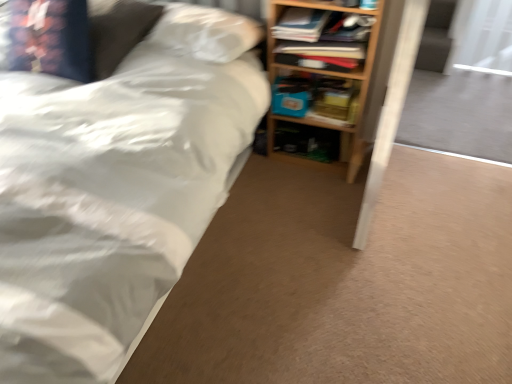
This screenshot has width=512, height=384. What do you see at coordinates (116, 188) in the screenshot?
I see `white matte bed at upper left` at bounding box center [116, 188].

Describe the element at coordinates (320, 39) in the screenshot. I see `wooden bookshelf at upper right, the first book from the front` at that location.

You are a GUI agent. You are given a task and a screenshot of the screen. Output one action in this format:
    pyautogui.click(x=<x>, y=<y>)
    Task: Click on the velvet-like floral pillow at upper left
    The width and height of the screenshot is (512, 384).
    Given the screenshot: What is the action you would take?
    pyautogui.click(x=50, y=38)

Find the location of a particular element. The width and height of the screenshot is (512, 384). wooden bookshelf at right is located at coordinates (342, 77).

The height and width of the screenshot is (384, 512). I want to click on transparent plastic screen door at upper right, so click(482, 35).

From the picture: Which of these two, blue matte paperback book at center or white matte bed at upper left, stands taller?

white matte bed at upper left is taller.

Considering the sizes of objects blue matte paperback book at center and white matte bed at upper left in the image provided, who is smaller, blue matte paperback book at center or white matte bed at upper left?

blue matte paperback book at center.

Looking at this image, would you say blue matte paperback book at center is outside white matte bed at upper left?

No, most part of blue matte paperback book at center lies within white matte bed at upper left.

Is blue matte paperback book at center with white matte bed at upper left?

No, blue matte paperback book at center is not with white matte bed at upper left.

Could you tell me if white matte bed at upper left is turned towards wooden bookshelf at right?

No, white matte bed at upper left is not turned towards wooden bookshelf at right.

Is white matte bed at upper left bigger or smaller than wooden bookshelf at right?

white matte bed at upper left is bigger than wooden bookshelf at right.

Which object is wider, white matte bed at upper left or wooden bookshelf at right?

white matte bed at upper left.

Which object is positioned more to the right, white matte bed at upper left or wooden bookshelf at right?

wooden bookshelf at right is more to the right.

Between wooden bookshelf at right and wooden bookshelf at upper right, the first book from the front, which one has larger width?

Wider between the two is wooden bookshelf at right.

Considering the positions of point (337, 125) and point (352, 50), is point (337, 125) closer or farther from the camera than point (352, 50)?

Point (337, 125) appears to be farther away from the viewer than point (352, 50).

Is wooden bookshelf at right bigger or smaller than wooden bookshelf at upper right, the second book in the back-to-front sequence?

Clearly, wooden bookshelf at right is larger in size than wooden bookshelf at upper right, the second book in the back-to-front sequence.

Is blue matte paperback book at center at the left side of matte blue book at center, acting as the 2th book starting from the front?

Yes.

Does blue matte paperback book at center have a larger size compared to matte blue book at center, which ranks as the first book in back-to-front order?

Actually, blue matte paperback book at center might be smaller than matte blue book at center, which ranks as the first book in back-to-front order.

Which of these two, blue matte paperback book at center or matte blue book at center, which ranks as the first book in back-to-front order, stands taller?

Standing taller between the two is matte blue book at center, which ranks as the first book in back-to-front order.

How much distance is there between matte blue book at center, acting as the 2th book starting from the front, and wooden bookshelf at upper right, the first book from the front?

matte blue book at center, acting as the 2th book starting from the front, and wooden bookshelf at upper right, the first book from the front, are 9.46 inches apart.

Is matte blue book at center, acting as the 2th book starting from the front, at the right side of wooden bookshelf at upper right, the second book in the back-to-front sequence?

Yes, matte blue book at center, acting as the 2th book starting from the front, is to the right of wooden bookshelf at upper right, the second book in the back-to-front sequence.

Which of these two, matte blue book at center, acting as the 2th book starting from the front, or wooden bookshelf at upper right, the second book in the back-to-front sequence, is thinner?

With smaller width is matte blue book at center, acting as the 2th book starting from the front.

Considering the points (314, 105) and (287, 19), which point is in front, point (314, 105) or point (287, 19)?

The point (287, 19) is closer to the camera.

Considering the sizes of wooden bookshelf at upper right, the first book from the front, and blue matte paperback book at center in the image, is wooden bookshelf at upper right, the first book from the front, wider or thinner than blue matte paperback book at center?

Considering their sizes, wooden bookshelf at upper right, the first book from the front, looks broader than blue matte paperback book at center.

Based on the photo, which of these two, wooden bookshelf at upper right, the first book from the front, or blue matte paperback book at center, stands shorter?

blue matte paperback book at center.

How many degrees apart are the facing directions of wooden bookshelf at upper right, the first book from the front, and blue matte paperback book at center?

1.53 degrees.

Which is farther from the camera, (309, 86) or (465, 9)?

Positioned behind is point (465, 9).

I want to click on screen door behind the matte blue book at center, which ranks as the first book in back-to-front order, so click(482, 35).

Does matte blue book at center, which ranks as the first book in back-to-front order, turn towards transparent plastic screen door at upper right?

No.

Does matte blue book at center, which ranks as the first book in back-to-front order, have a greater height compared to transparent plastic screen door at upper right?

In fact, matte blue book at center, which ranks as the first book in back-to-front order, may be shorter than transparent plastic screen door at upper right.

Find the location of a particular element. This screenshot has height=384, width=512. bed above the blue matte paperback book at center (from a real-world perspective) is located at coordinates (116, 188).

You are a GUI agent. You are given a task and a screenshot of the screen. Output one action in this format:
    pyautogui.click(x=<x>, y=<y>)
    Task: Click on the shelf that appears below the white matte bed at upper left (from a real-world perspective)
    This screenshot has height=384, width=512.
    Given the screenshot: What is the action you would take?
    pyautogui.click(x=342, y=77)

Considering their positions, is blue matte paperback book at center positioned closer to wooden bookshelf at right than transparent plastic screen door at upper right?

blue matte paperback book at center lies closer to wooden bookshelf at right than the other object.

Based on the photo, when comparing their distances from transparent plastic screen door at upper right, does wooden bookshelf at upper right, the second book in the back-to-front sequence, or velvet-like floral pillow at upper left seem closer?

wooden bookshelf at upper right, the second book in the back-to-front sequence, is closer to transparent plastic screen door at upper right.

From the image, which object appears to be nearer to blue matte paperback book at center, white matte bed at upper left or matte blue book at center, acting as the 2th book starting from the front?

matte blue book at center, acting as the 2th book starting from the front, is closer to blue matte paperback book at center.

When comparing their distances from blue matte paperback book at center, does wooden bookshelf at upper right, the first book from the front, or velvet-like floral pillow at upper left seem closer?

Based on the image, wooden bookshelf at upper right, the first book from the front, appears to be nearer to blue matte paperback book at center.

Looking at the image, which one is located closer to blue matte paperback book at center, white matte bed at upper left or wooden bookshelf at upper right, the second book in the back-to-front sequence?

The object closer to blue matte paperback book at center is wooden bookshelf at upper right, the second book in the back-to-front sequence.

From the image, which object appears to be nearer to wooden bookshelf at right, velvet-like floral pillow at upper left or transparent plastic screen door at upper right?

velvet-like floral pillow at upper left is closer to wooden bookshelf at right.

Based on their spatial positions, is velvet-like floral pillow at upper left or wooden bookshelf at right further from blue matte paperback book at center?

velvet-like floral pillow at upper left.

When comparing their distances from white matte bed at upper left, does wooden bookshelf at right or wooden bookshelf at upper right, the first book from the front, seem closer?

Based on the image, wooden bookshelf at upper right, the first book from the front, appears to be nearer to white matte bed at upper left.

Image resolution: width=512 pixels, height=384 pixels. I want to click on pillow positioned between white matte bed at upper left and matte blue book at center, acting as the 2th book starting from the front, from near to far, so click(50, 38).

Find the location of a particular element. The image size is (512, 384). pillow located between white matte bed at upper left and transparent plastic screen door at upper right in the left-right direction is located at coordinates (50, 38).

What are the coordinates of `shelf between white matte bed at upper left and matte blue book at center, acting as the 2th book starting from the front, in the front-back direction` in the screenshot? It's located at (342, 77).

The width and height of the screenshot is (512, 384). Find the location of `pillow positioned between white matte bed at upper left and wooden bookshelf at upper right, the first book from the front, from near to far`. pillow positioned between white matte bed at upper left and wooden bookshelf at upper right, the first book from the front, from near to far is located at coordinates (50, 38).